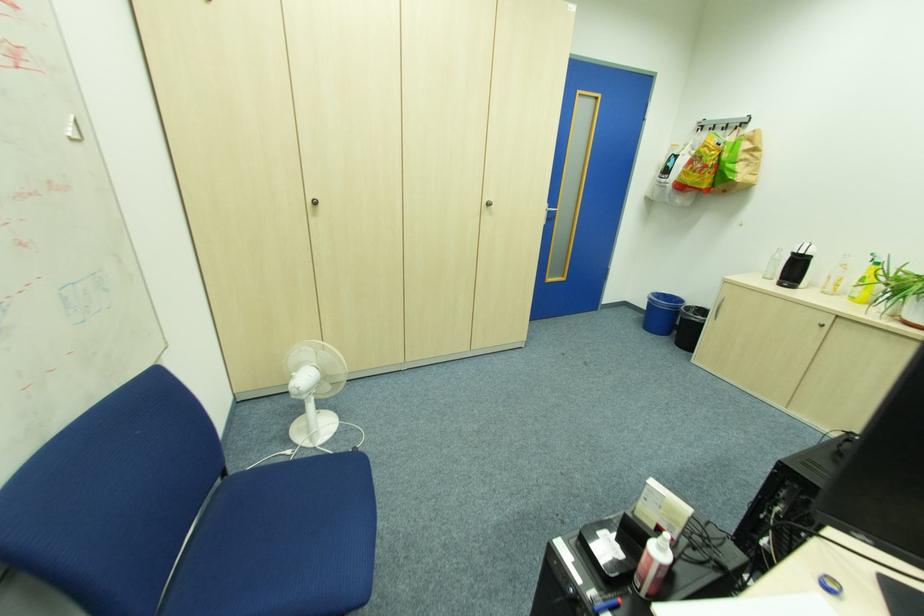
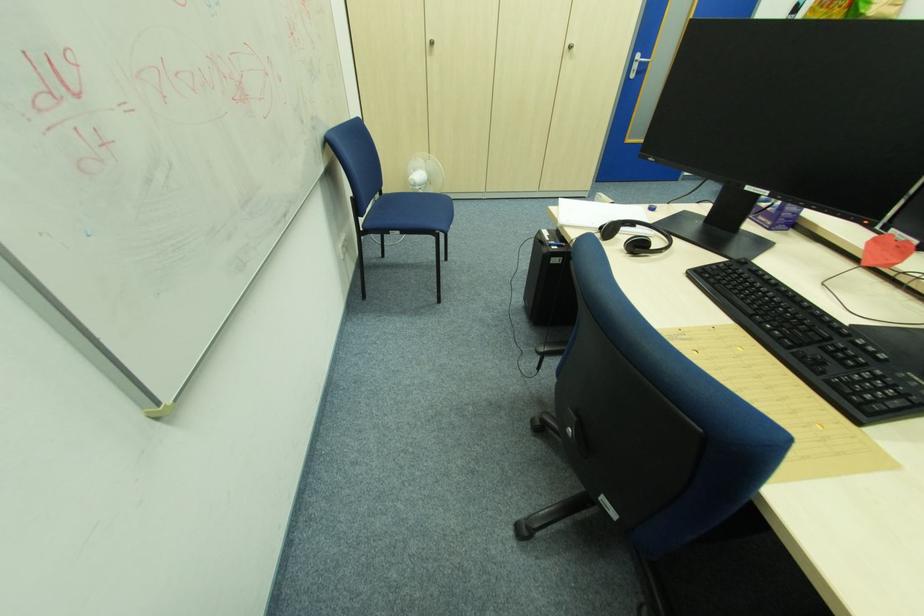
The point at (329, 379) is marked in the first image. Where is the corresponding point in the second image?

(434, 183)